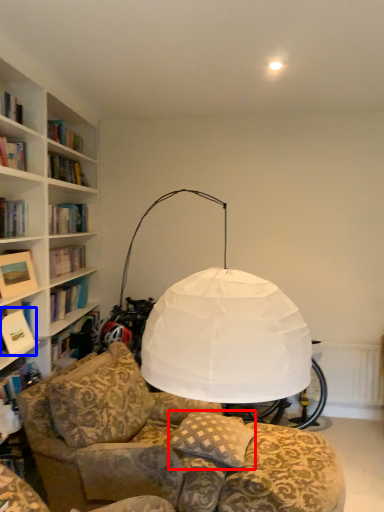
Question: Which of the following is the farthest to the observer, pillow (highlighted by a red box) or book (highlighted by a blue box)?

Choices:
 (A) pillow
 (B) book

Answer: (B)